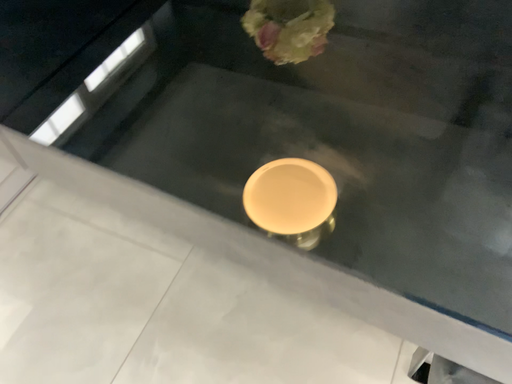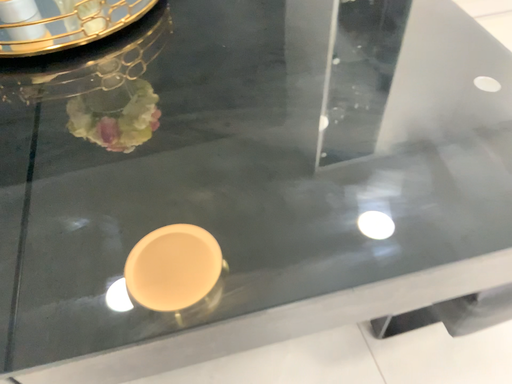
Question: How did the camera likely rotate when shooting the video?

Choices:
 (A) rotated left
 (B) rotated right

Answer: (B)